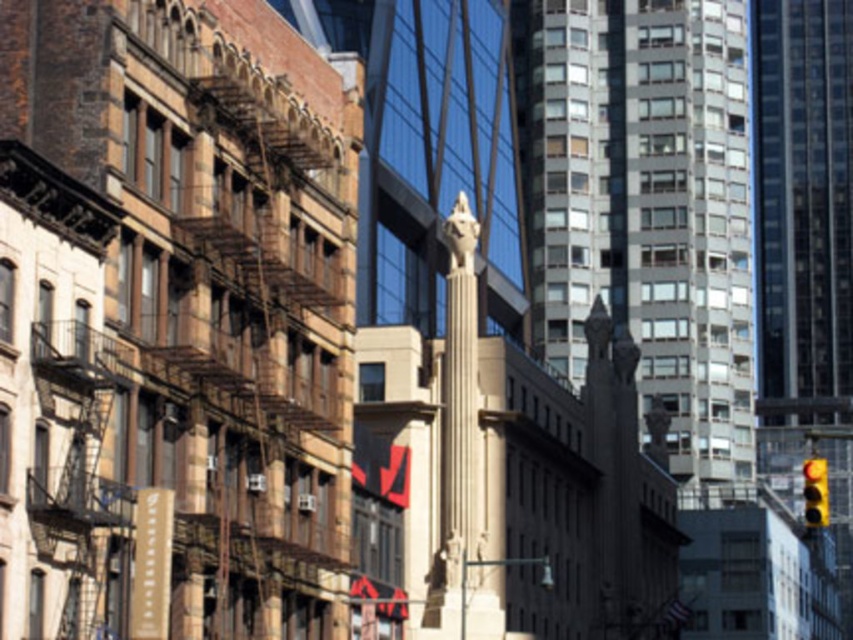
You are standing in the middle of an urban area and want to take a photo of the gray glass tower at center. If your camera can focus on objects up to 100 meters away, will you need to move closer to get a clear shot?

The gray glass tower at center is 121.26 meters away from viewer, so you need to move closer to ensure the camera can focus properly.

You are a city planner assessing building sizes for zoning compliance. Given the gray glass tower at center and the glassy reflective tower at right, which one must adhere to stricter height restrictions if the smaller building has more stringent regulations?

The gray glass tower at center must adhere to stricter height restrictions because it is smaller than the glassy reflective tower at right, and smaller buildings in this context are subject to more stringent regulations.

You are a city planner evaluating the urban landscape. You need to determine if the gray glass tower at center will block sunlight from reaching the yellow matte traffic light at lower right. Based on their relative heights, can you conclude this?

The gray glass tower at center is taller than the yellow matte traffic light at lower right. Since the tower is much taller, it could potentially block sunlight from reaching the traffic light depending on their positions and the sun angle.